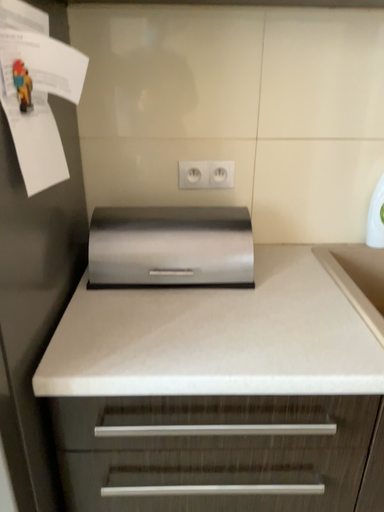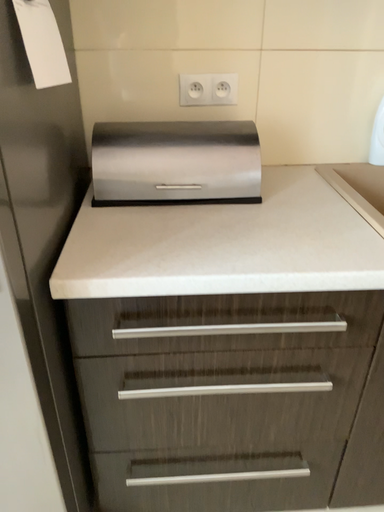
Question: Which way did the camera rotate in the video?

Choices:
 (A) rotated downward
 (B) rotated upward

Answer: (A)